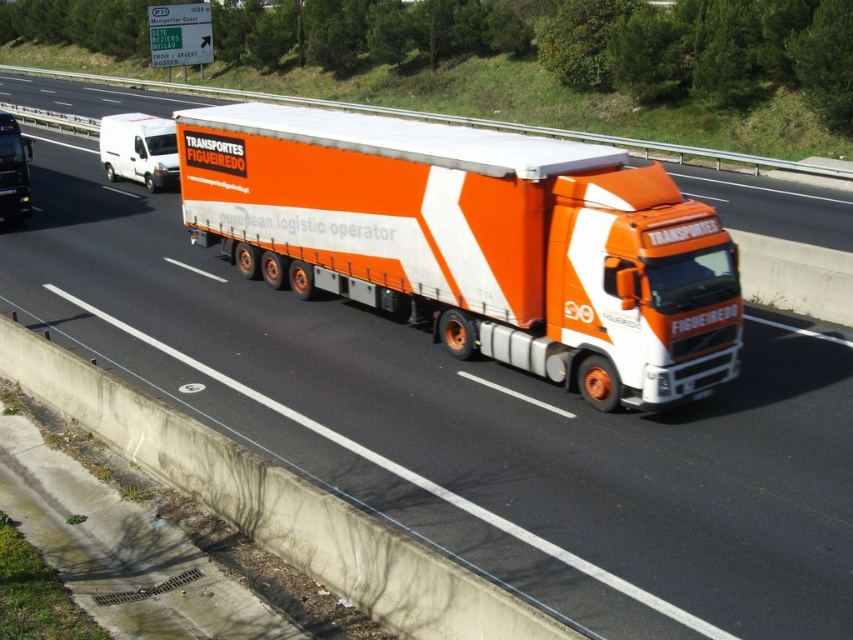
Question: Does white matte van at left appear over matte black truck at left?

Choices:
 (A) yes
 (B) no

Answer: (A)

Question: Which object is farther from the camera taking this photo?

Choices:
 (A) matte black truck at left
 (B) orange matte trailer truck at center
 (C) white matte van at left

Answer: (C)

Question: From the image, what is the correct spatial relationship of orange matte trailer truck at center in relation to matte black truck at left?

Choices:
 (A) above
 (B) below

Answer: (B)

Question: Which object appears farthest from the camera in this image?

Choices:
 (A) orange matte trailer truck at center
 (B) white matte van at left
 (C) matte black truck at left

Answer: (B)

Question: Does orange matte trailer truck at center appear under white matte van at left?

Choices:
 (A) no
 (B) yes

Answer: (B)

Question: Among these objects, which one is farthest from the camera?

Choices:
 (A) orange matte trailer truck at center
 (B) white matte van at left
 (C) matte black truck at left

Answer: (B)